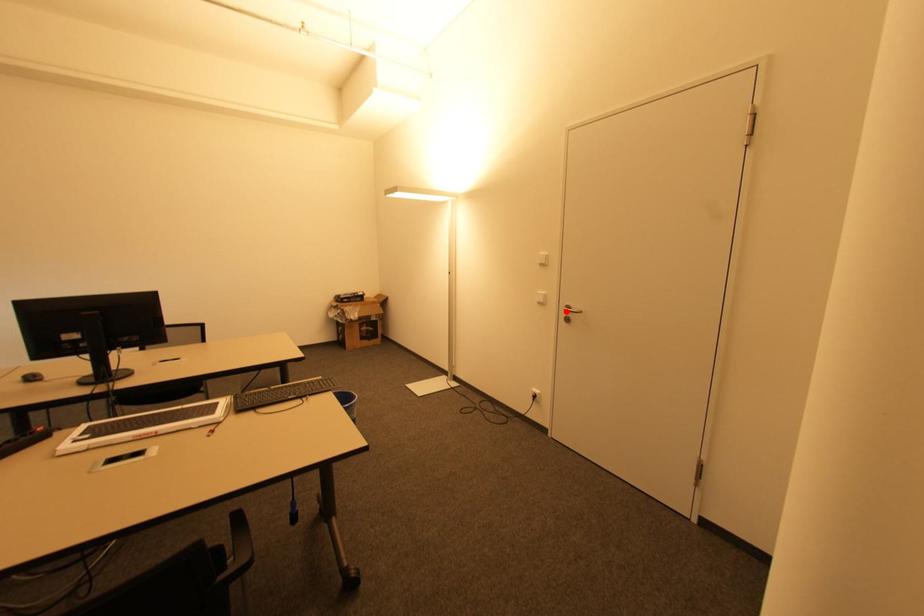
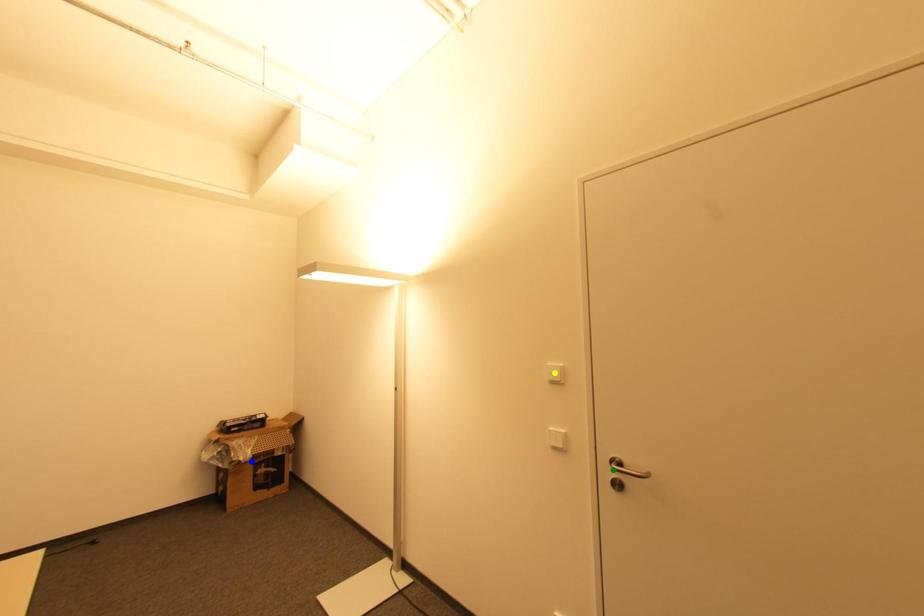
Question: I am providing you with two images of the same scene from different viewpoints. A red point is marked on the first image. You are given multiple points on the second image. Which point in image 2 represents the same 3d spot as the red point in image 1?

Choices:
 (A) blue point
 (B) green point
 (C) yellow point

Answer: (B)